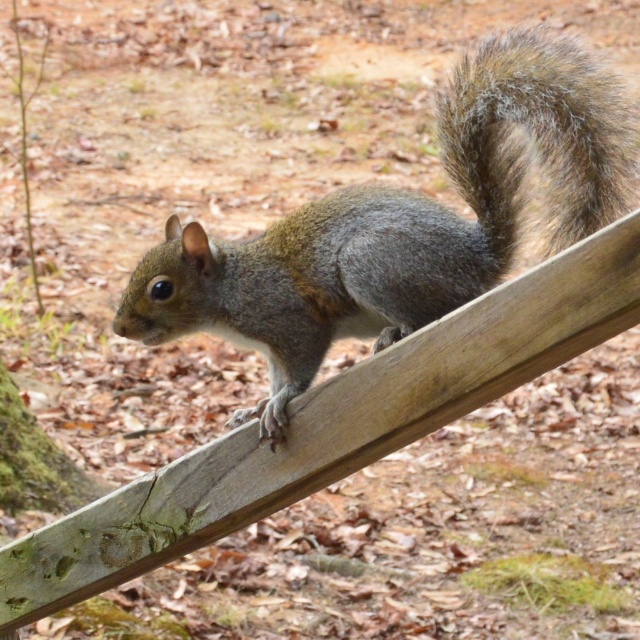
Which is behind, point (444, 220) or point (540, 116)?

Point (444, 220)

I want to click on gray furry squirrel on the right, so click(x=401, y=225).